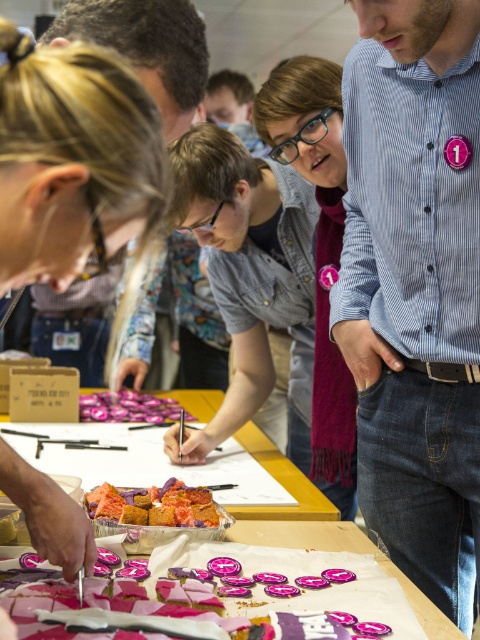
Is purple scarf at center further to camera compared to matte black shirt at upper center?

That is False.

At what (x,y) coordinates should I click in order to perform the action: click on purple scarf at center. Please return your answer as a coordinate pair (x, y). The height and width of the screenshot is (640, 480). Looking at the image, I should click on (319, 248).

Between matte black shirt at upper center and pink glossy buttons at lower center, which one has less height?

pink glossy buttons at lower center

Where is `matte black shirt at upper center`? The height and width of the screenshot is (640, 480). matte black shirt at upper center is located at coordinates (145, 48).

I want to click on matte black shirt at upper center, so click(x=145, y=48).

Does point (462, 637) lie behind point (199, 525)?

No, it is in front of (199, 525).

Does pink glossy buttons at lower center have a lesser width compared to crumbly pink cake at center?

In fact, pink glossy buttons at lower center might be wider than crumbly pink cake at center.

Does point (325, 528) come farther from viewer compared to point (165, 522)?

Yes, point (325, 528) is behind point (165, 522).

Locate an element on the screen. pink glossy buttons at lower center is located at coordinates (342, 548).